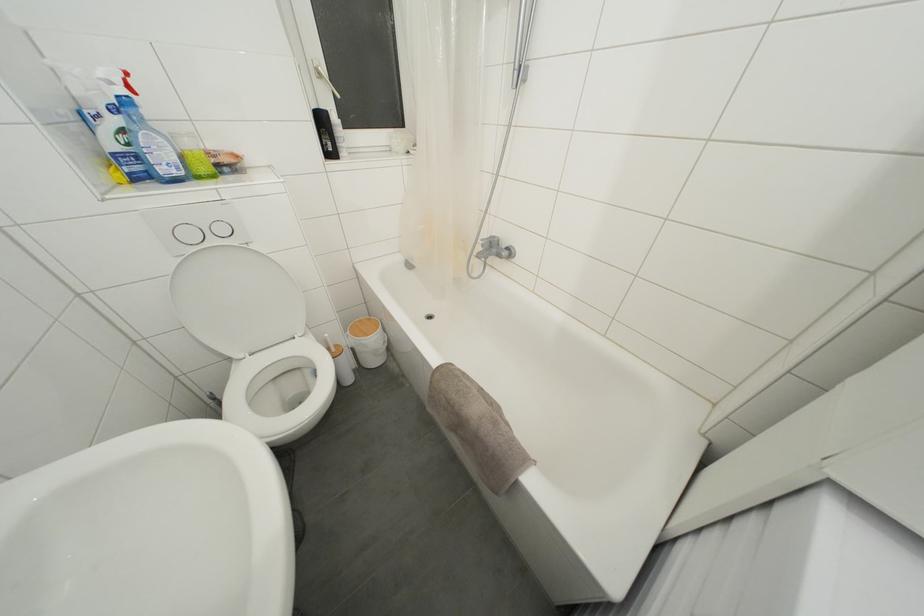
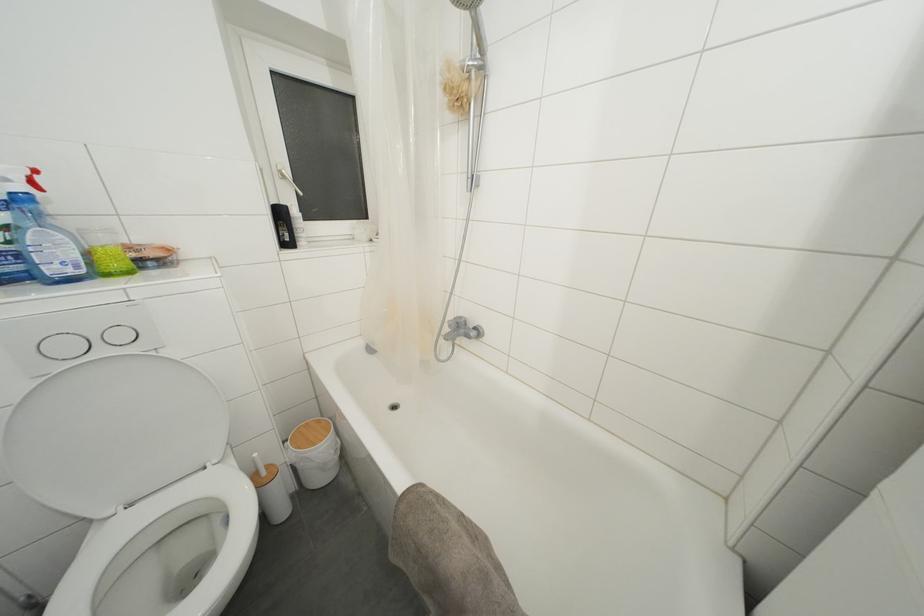
In the second image, find the point that corresponds to [363,326] in the first image.

(310, 429)